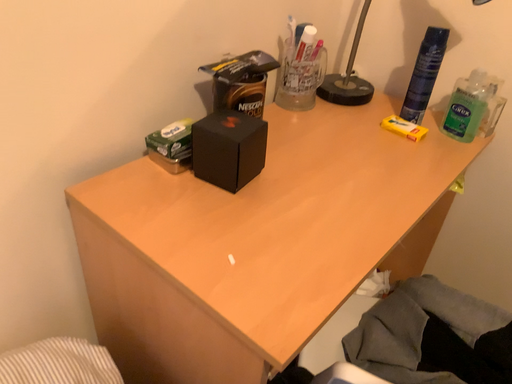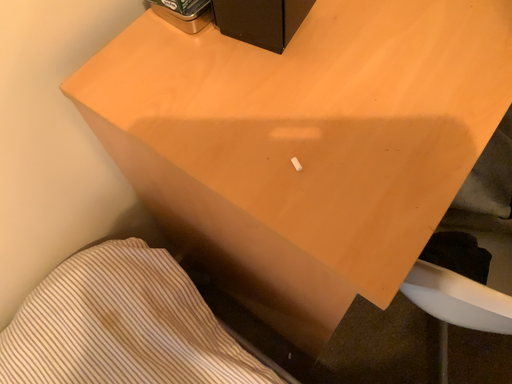
Question: How did the camera likely rotate when shooting the video?

Choices:
 (A) rotated upward
 (B) rotated downward

Answer: (B)